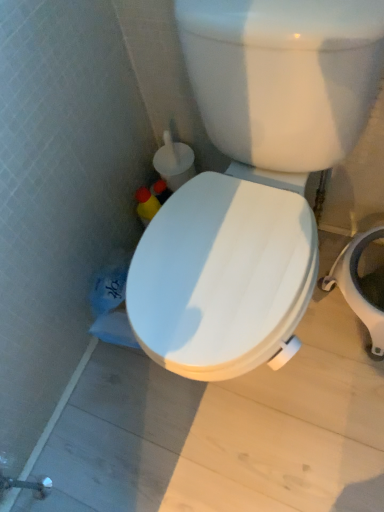
What do you see at coordinates (223, 277) in the screenshot?
I see `white glossy toilet seat at center` at bounding box center [223, 277].

Locate an element on the screen. white glossy toilet seat at center is located at coordinates (223, 277).

Measure the distance between white glossy toilet seat at center and camera.

white glossy toilet seat at center and camera are 25.53 inches apart from each other.

The width and height of the screenshot is (384, 512). What do you see at coordinates (358, 286) in the screenshot? I see `white plastic bidet at right` at bounding box center [358, 286].

At what (x,y) coordinates should I click in order to perform the action: click on white plastic bidet at right. Please return your answer as a coordinate pair (x, y). The width and height of the screenshot is (384, 512). Looking at the image, I should click on (358, 286).

What is the approximate width of white plastic bidet at right?

white plastic bidet at right is 14.59 inches wide.

Find the location of a particular element. The image size is (384, 512). white glossy toilet seat at center is located at coordinates (223, 277).

Considering the positions of objects white plastic bidet at right and white glossy toilet seat at center in the image provided, who is more to the left, white plastic bidet at right or white glossy toilet seat at center?

Positioned to the left is white glossy toilet seat at center.

In the image, is white plastic bidet at right positioned in front of or behind white glossy toilet seat at center?

white plastic bidet at right is behind white glossy toilet seat at center.

Which is in front, point (377, 311) or point (139, 316)?

The point (139, 316) is closer.

From the image's perspective, which is above, white plastic bidet at right or white glossy toilet seat at center?

From the image's view, white glossy toilet seat at center is above.

From a real-world perspective, is white plastic bidet at right on top of white glossy toilet seat at center?

Actually, white plastic bidet at right is physically below white glossy toilet seat at center in the real world.

Considering the relative sizes of white plastic bidet at right and white glossy toilet seat at center in the image provided, is white plastic bidet at right wider than white glossy toilet seat at center?

In fact, white plastic bidet at right might be narrower than white glossy toilet seat at center.

Considering the sizes of objects white plastic bidet at right and white glossy toilet seat at center in the image provided, who is taller, white plastic bidet at right or white glossy toilet seat at center?

white glossy toilet seat at center.

Considering the sizes of objects white plastic bidet at right and white glossy toilet seat at center in the image provided, who is bigger, white plastic bidet at right or white glossy toilet seat at center?

white glossy toilet seat at center.

Is white plastic bidet at right not within white glossy toilet seat at center?

Indeed, white plastic bidet at right is completely outside white glossy toilet seat at center.

From the picture: Is white plastic bidet at right directly adjacent to white glossy toilet seat at center?

No, white plastic bidet at right is not beside white glossy toilet seat at center.

Is white plastic bidet at right positioned with its back to white glossy toilet seat at center?

No, white plastic bidet at right is not facing the opposite direction of white glossy toilet seat at center.

At what (x,y) coordinates should I click in order to perform the action: click on bidet on the right of white glossy toilet seat at center. Please return your answer as a coordinate pair (x, y). Looking at the image, I should click on (358, 286).

Which object is positioned more to the right, white glossy toilet seat at center or white plastic bidet at right?

Positioned to the right is white plastic bidet at right.

Is white glossy toilet seat at center positioned behind white plastic bidet at right?

No, the depth of white glossy toilet seat at center is less than that of white plastic bidet at right.

Does point (305, 297) come behind point (366, 241)?

No, (305, 297) is in front of (366, 241).

From the image's perspective, does white glossy toilet seat at center appear higher than white plastic bidet at right?

Yes, from the image's perspective, white glossy toilet seat at center is above white plastic bidet at right.

From a real-world perspective, is white glossy toilet seat at center on top of white plastic bidet at right?

Indeed, from a real-world perspective, white glossy toilet seat at center stands above white plastic bidet at right.

Considering the relative sizes of white glossy toilet seat at center and white plastic bidet at right in the image provided, is white glossy toilet seat at center wider than white plastic bidet at right?

Indeed, white glossy toilet seat at center has a greater width compared to white plastic bidet at right.

Does white glossy toilet seat at center have a greater height compared to white plastic bidet at right?

Yes.

Can you confirm if white glossy toilet seat at center is bigger than white plastic bidet at right?

Yes.

From the picture: Choose the correct answer: Is white glossy toilet seat at center inside white plastic bidet at right or outside it?

white glossy toilet seat at center is spatially situated outside white plastic bidet at right.

Are white glossy toilet seat at center and white plastic bidet at right far apart?

They are positioned close to each other.

Does white glossy toilet seat at center turn towards white plastic bidet at right?

No, white glossy toilet seat at center does not turn towards white plastic bidet at right.

What's the angular difference between white glossy toilet seat at center and white plastic bidet at right's facing directions?

The facing directions of white glossy toilet seat at center and white plastic bidet at right are 0.447 degrees apart.

Measure the distance between white glossy toilet seat at center and white plastic bidet at right.

white glossy toilet seat at center and white plastic bidet at right are 16.54 inches apart.

At what (x,y) coordinates should I click in order to perform the action: click on toilet above the white plastic bidet at right (from the image's perspective). Please return your answer as a coordinate pair (x, y). Looking at the image, I should click on (223, 277).

Image resolution: width=384 pixels, height=512 pixels. Find the location of `bidet below the white glossy toilet seat at center (from a real-world perspective)`. bidet below the white glossy toilet seat at center (from a real-world perspective) is located at coordinates (358, 286).

I want to click on toilet located above the white plastic bidet at right (from a real-world perspective), so click(223, 277).